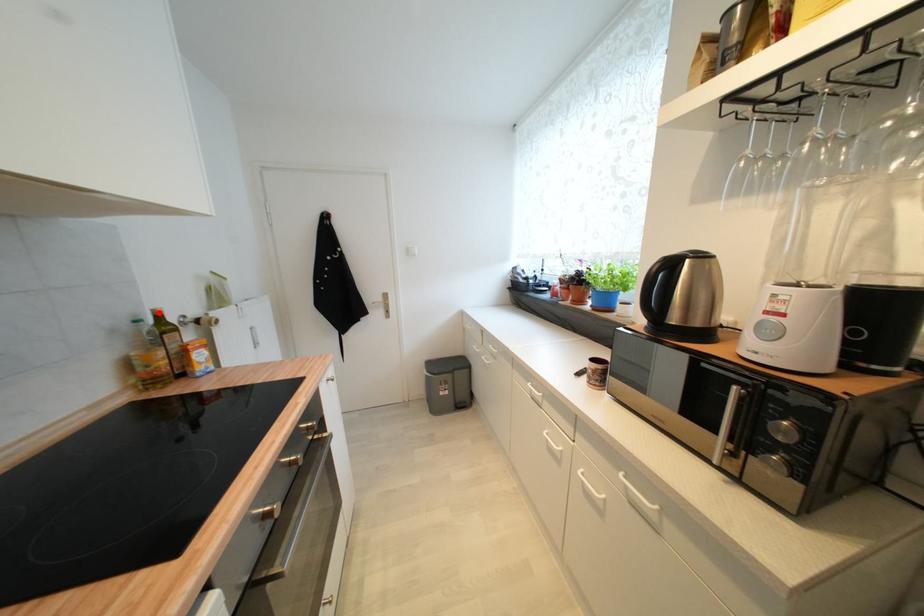
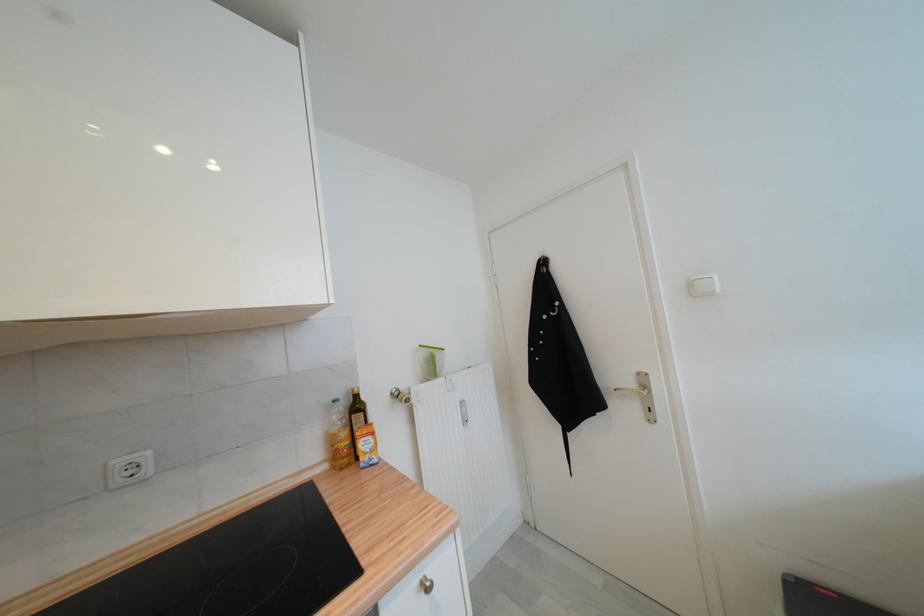
In the second image, find the point that corresponds to the highlighted location in the first image.

(358, 392)